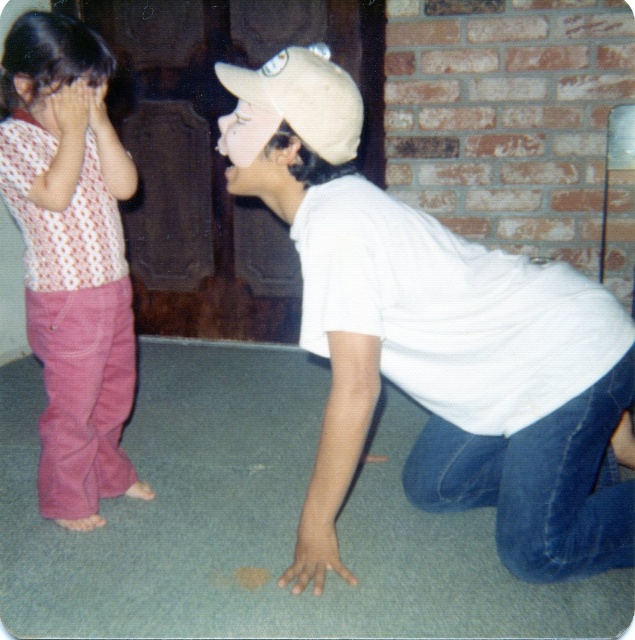
Question: Can you confirm if white matte shirt at center is positioned above dotted fabric shirt at left?

Choices:
 (A) yes
 (B) no

Answer: (B)

Question: Which object appears farthest from the camera in this image?

Choices:
 (A) white matte shirt at center
 (B) dotted fabric shirt at left

Answer: (B)

Question: Which object is positioned farthest from the beige fabric baseball cap at center?

Choices:
 (A) white matte shirt at center
 (B) dotted fabric shirt at left

Answer: (B)

Question: Does dotted fabric shirt at left have a smaller size compared to beige fabric baseball cap at center?

Choices:
 (A) yes
 (B) no

Answer: (B)

Question: From the image, what is the correct spatial relationship of dotted fabric shirt at left in relation to beige fabric baseball cap at center?

Choices:
 (A) above
 (B) below

Answer: (B)

Question: Which point appears farthest from the camera in this image?

Choices:
 (A) (337, 96)
 (B) (50, 304)
 (C) (224, 122)

Answer: (B)